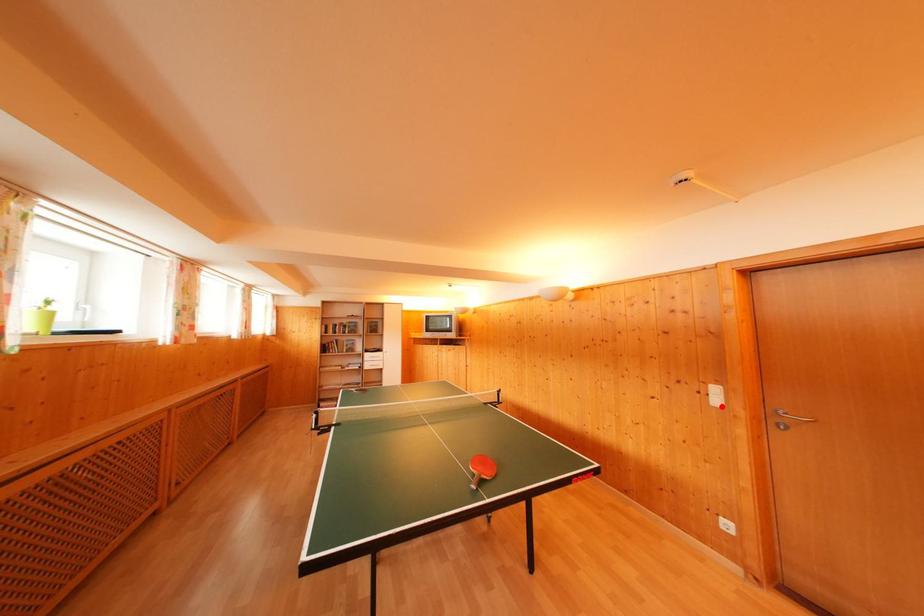
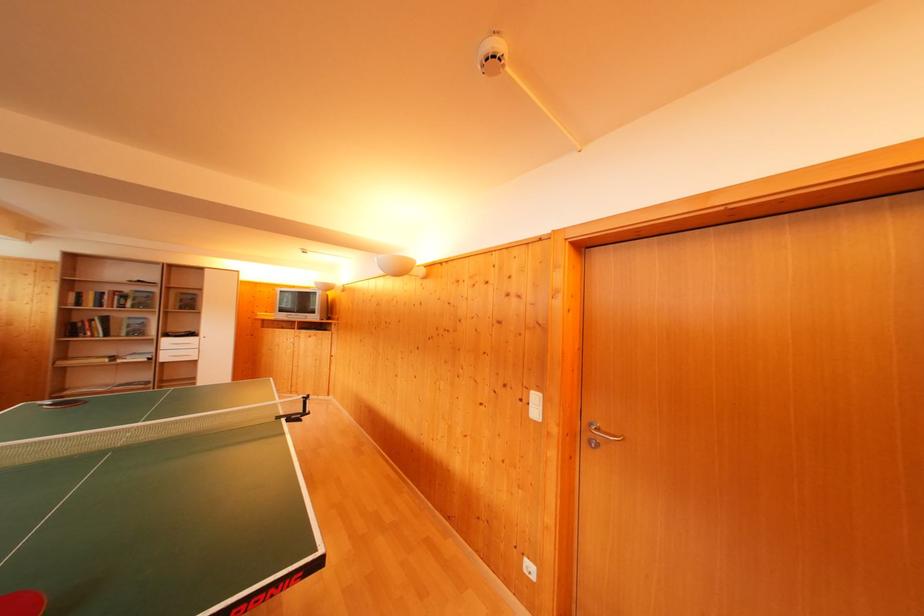
In the second image, find the point that corresponds to the highlighted location in the first image.

(541, 418)